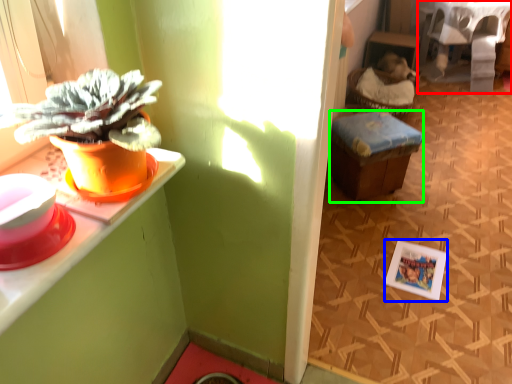
Question: Which is farther away from table (highlighted by a red box)? picture frame (highlighted by a blue box) or stool (highlighted by a green box)?

Choices:
 (A) picture frame
 (B) stool

Answer: (A)